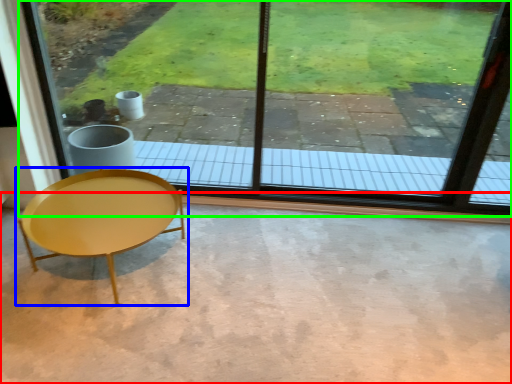
Question: Considering the real-world distances, which object is farthest from concrete (highlighted by a red box)? coffee table (highlighted by a blue box) or window (highlighted by a green box)?

Choices:
 (A) coffee table
 (B) window

Answer: (B)